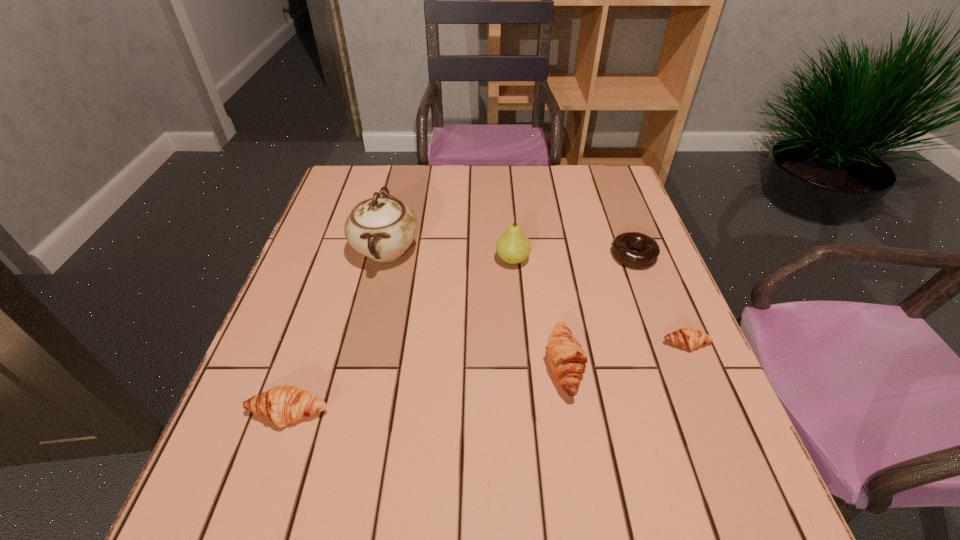
The width and height of the screenshot is (960, 540). I want to click on vacant space located 0.220m on the front of the tallest object, so click(360, 359).

Locate an element on the screen. The image size is (960, 540). blank space located 0.070m on the left of the pear is located at coordinates (468, 260).

This screenshot has width=960, height=540. I want to click on free location located 0.330m on the left of the doughnut, so click(481, 256).

Find the location of a particular element. object that is at the near edge is located at coordinates (282, 405).

Find the location of a particular element. The width and height of the screenshot is (960, 540). pastry located in the left edge section of the desktop is located at coordinates (282, 405).

Identify the location of chinaware that is at the left edge. The image size is (960, 540). (382, 228).

The width and height of the screenshot is (960, 540). Identify the location of pastry located at the right edge. (687, 338).

Where is `doughnut that is at the right edge`? The height and width of the screenshot is (540, 960). doughnut that is at the right edge is located at coordinates (621, 245).

The height and width of the screenshot is (540, 960). I want to click on object that is at the near left corner, so click(282, 405).

At what (x,y) coordinates should I click in order to perform the action: click on free space at the far edge of the desktop. Please return your answer as a coordinate pair (x, y). Image resolution: width=960 pixels, height=540 pixels. Looking at the image, I should click on (486, 183).